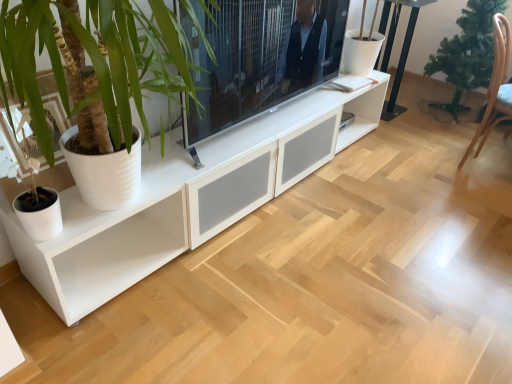
Image resolution: width=512 pixels, height=384 pixels. In order to click on free point in front of black metal table at upper right in this screenshot , I will do `click(399, 126)`.